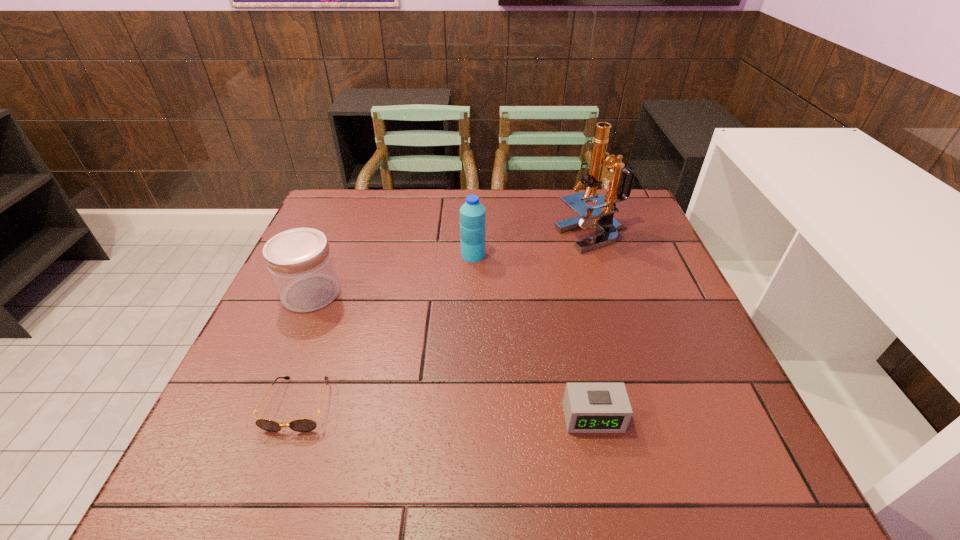
Find the location of `vacant space at the near edge of the desktop`. vacant space at the near edge of the desktop is located at coordinates (410, 473).

The image size is (960, 540). I want to click on vacant region at the left edge of the desktop, so click(x=246, y=355).

The width and height of the screenshot is (960, 540). Identify the location of free space at the right edge of the desktop. (676, 322).

Identify the location of free space at the far left corner of the desktop. The width and height of the screenshot is (960, 540). (362, 223).

The height and width of the screenshot is (540, 960). What are the coordinates of `free location at the far right corner` in the screenshot? It's located at click(x=643, y=232).

The height and width of the screenshot is (540, 960). I want to click on empty space that is in between the fourth tallest object and the third tallest object, so click(452, 355).

At what (x,y) coordinates should I click in order to perform the action: click on vacant area between the alarm clock and the shortest object. Please return your answer as a coordinate pair (x, y). The width and height of the screenshot is (960, 540). Looking at the image, I should click on (445, 411).

Locate an element on the screen. Image resolution: width=960 pixels, height=540 pixels. free space between the microscope and the water bottle is located at coordinates (533, 246).

I want to click on free space between the water bottle and the jar, so click(x=392, y=274).

Image resolution: width=960 pixels, height=540 pixels. Identify the location of vacant space that is in between the sunglasses and the alarm clock. (445, 411).